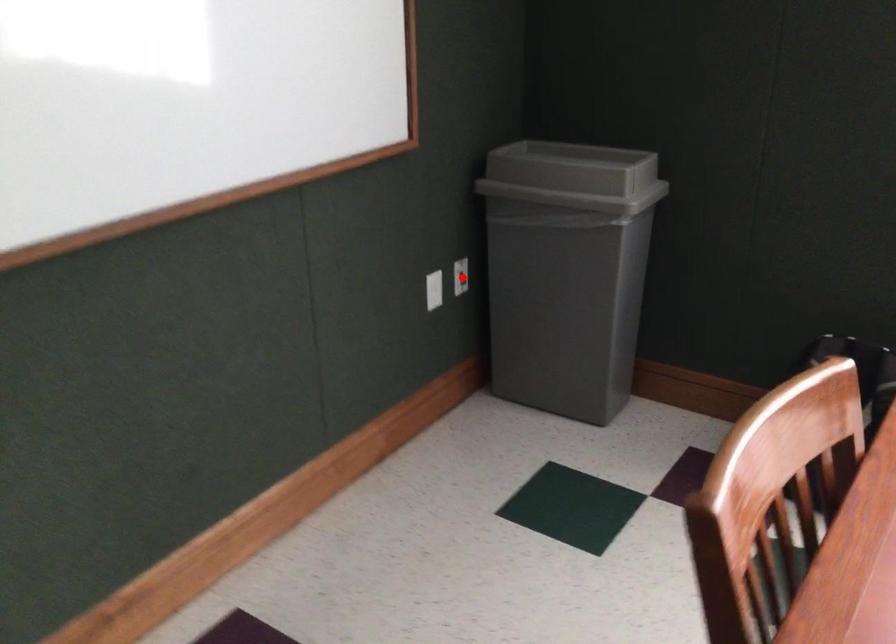
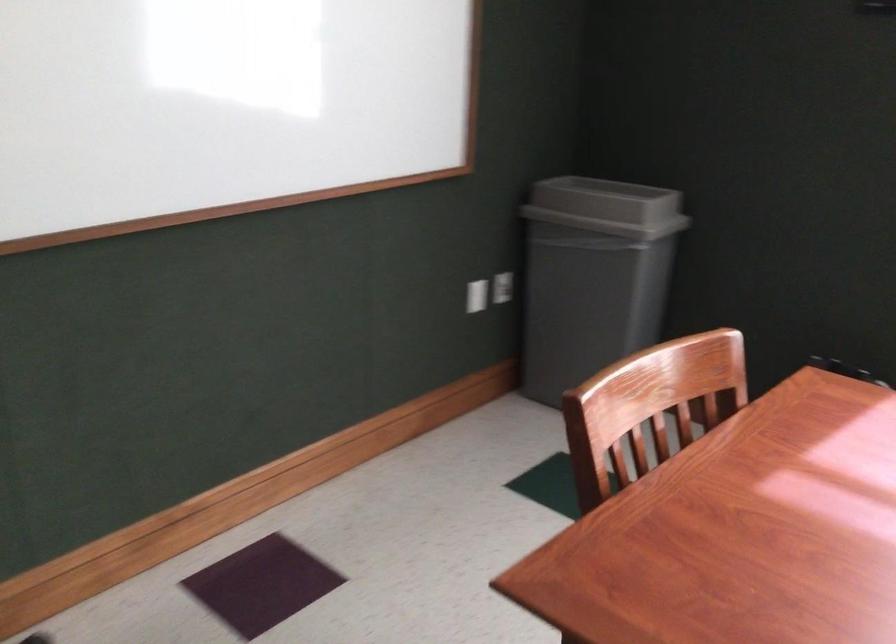
Locate, in the second image, the point that corresponds to the highlighted location in the first image.

(503, 287)